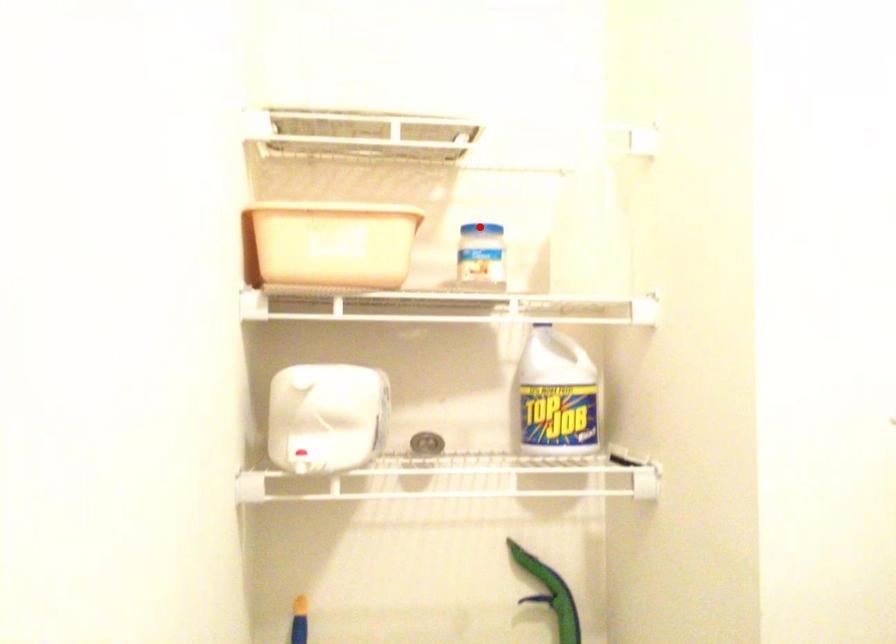
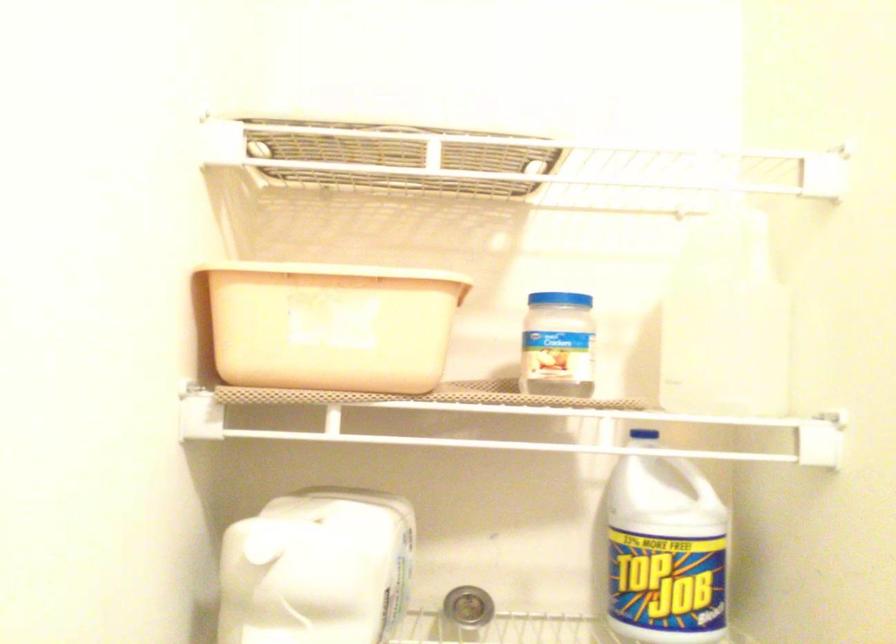
Where in the second image is the point corresponding to the highlighted location from the first image?

(558, 299)